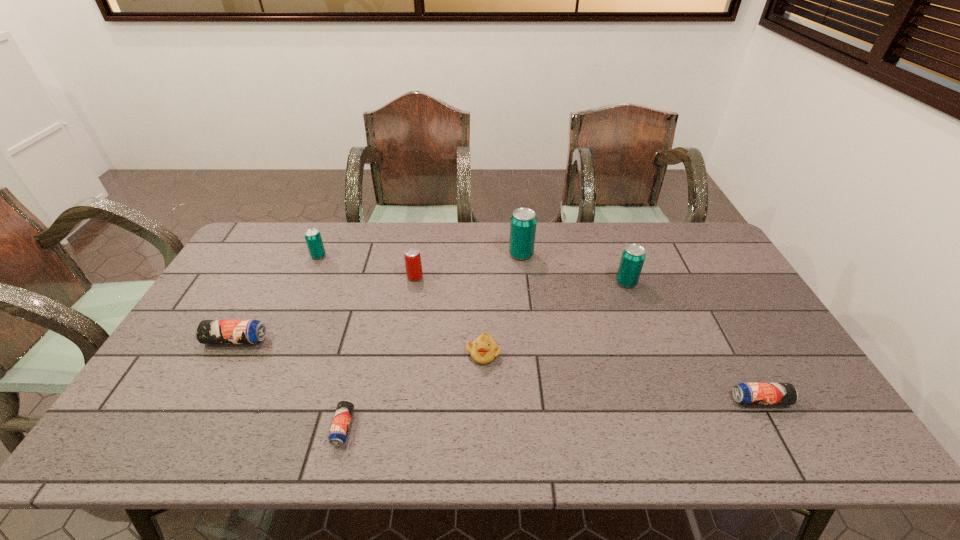
Locate an element on the screen. the tallest object is located at coordinates (523, 223).

Identify the location of the biggest teal beer can. The width and height of the screenshot is (960, 540). (523, 223).

Find the location of `the second tallest object`. the second tallest object is located at coordinates (633, 256).

Image resolution: width=960 pixels, height=540 pixels. Find the location of `the sixth beer can from left to right`. the sixth beer can from left to right is located at coordinates click(633, 256).

You are a GUI agent. You are given a task and a screenshot of the screen. Output one action in this format:
    pyautogui.click(x=<x>, y=<y>)
    Task: Click on the fifth object from right to left
    
    Given the screenshot: What is the action you would take?
    pyautogui.click(x=413, y=265)

Locate an element on the screen. The image size is (960, 540). the fourth beer can from right to left is located at coordinates (413, 265).

Find the location of a particular element. The height and width of the screenshot is (540, 960). the second object from left to right is located at coordinates pos(313,238).

At what (x,y) coordinates should I click in order to perform the action: click on the sixth beer can from right to left. Please return your answer as a coordinate pair (x, y). Image resolution: width=960 pixels, height=540 pixels. Looking at the image, I should click on (313, 238).

Identify the location of duckling. (483, 350).

Where is `yellow duckling`? yellow duckling is located at coordinates (483, 350).